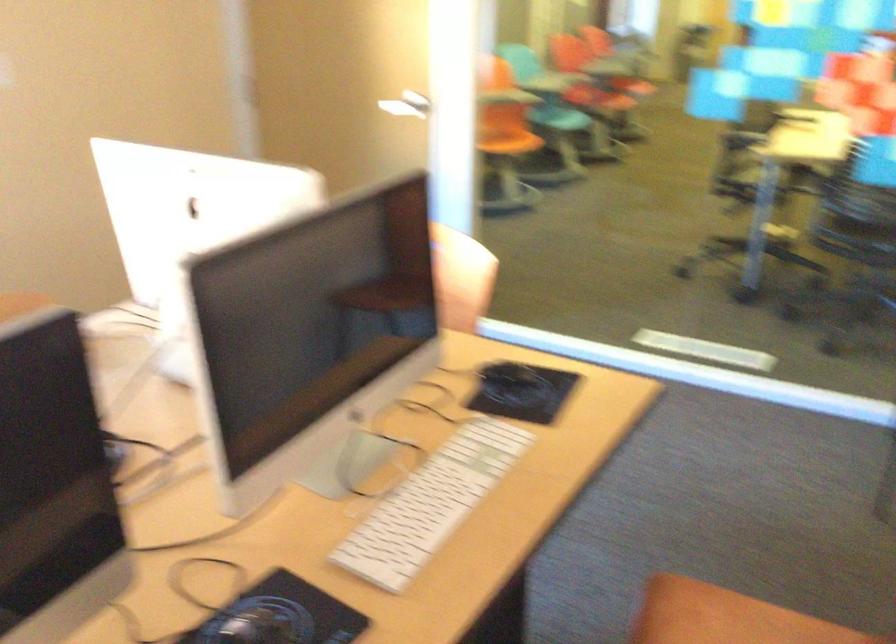
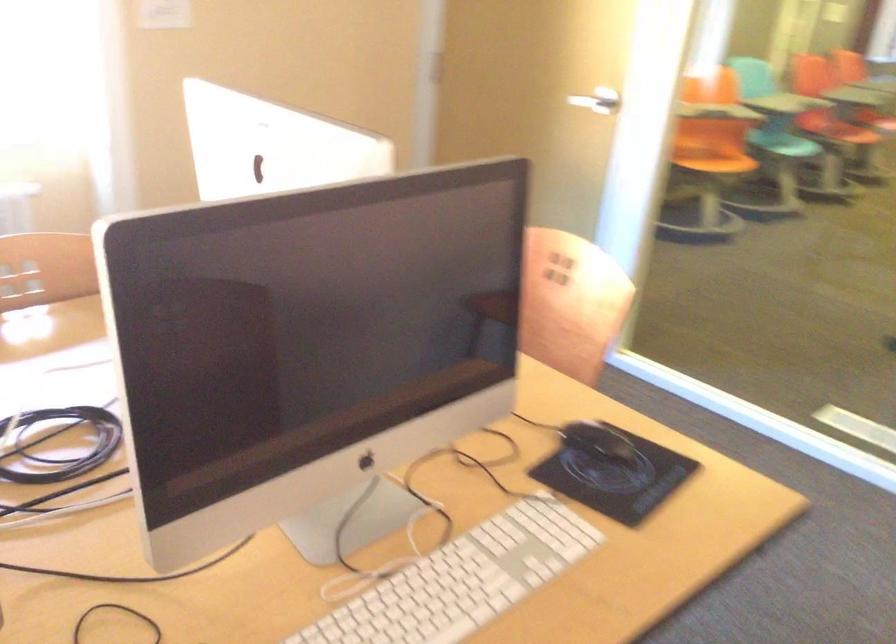
In a continuous first-person perspective shot, in which direction is the camera moving?

The cameraman moved toward right, forward.